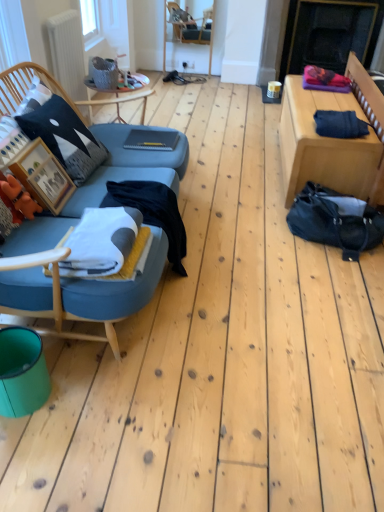
Question: Does white matte radiator at upper left have a greater height compared to white soft blanket at center?

Choices:
 (A) no
 (B) yes

Answer: (B)

Question: Can white soft blanket at center be found inside white matte radiator at upper left?

Choices:
 (A) yes
 (B) no

Answer: (B)

Question: Considering the relative sizes of white matte radiator at upper left and white soft blanket at center in the image provided, is white matte radiator at upper left shorter than white soft blanket at center?

Choices:
 (A) yes
 (B) no

Answer: (B)

Question: From a real-world perspective, is white matte radiator at upper left on white soft blanket at center?

Choices:
 (A) no
 (B) yes

Answer: (B)

Question: Is white matte radiator at upper left to the right of white soft blanket at center from the viewer's perspective?

Choices:
 (A) yes
 (B) no

Answer: (B)

Question: Does white matte radiator at upper left have a smaller size compared to white soft blanket at center?

Choices:
 (A) no
 (B) yes

Answer: (A)

Question: Is wooden chair at center positioned with its back to denim fabric at right, the second table in the left-to-right sequence?

Choices:
 (A) yes
 (B) no

Answer: (B)

Question: Does wooden chair at center have a lesser width compared to denim fabric at right, the second table in the left-to-right sequence?

Choices:
 (A) no
 (B) yes

Answer: (B)

Question: Considering the relative positions of wooden chair at center and denim fabric at right, the second table in the left-to-right sequence, in the image provided, is wooden chair at center to the left of denim fabric at right, the second table in the left-to-right sequence, from the viewer's perspective?

Choices:
 (A) yes
 (B) no

Answer: (A)

Question: Does wooden chair at center lie in front of denim fabric at right, the second table in the left-to-right sequence?

Choices:
 (A) no
 (B) yes

Answer: (A)

Question: Does wooden chair at center appear on the right side of denim fabric at right, the second table in the left-to-right sequence?

Choices:
 (A) yes
 (B) no

Answer: (B)

Question: Does wooden chair at center come behind denim fabric at right, acting as the first table starting from the right?

Choices:
 (A) no
 (B) yes

Answer: (B)

Question: From the image's perspective, would you say wooden chair at center is positioned over wooden picture frame at left?

Choices:
 (A) no
 (B) yes

Answer: (B)